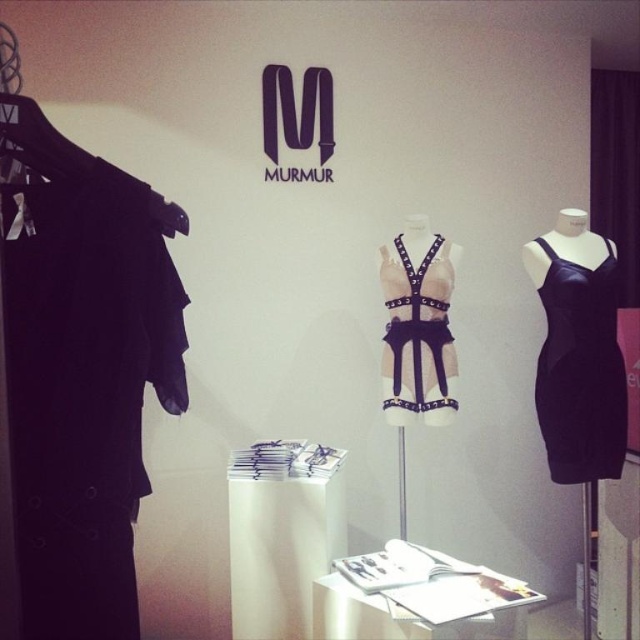
Question: Which of the following is the closest to the observer?

Choices:
 (A) satin black dress at right
 (B) leather harness at center

Answer: (A)

Question: Considering the relative positions of satin black dress at right and leather harness at center in the image provided, where is satin black dress at right located with respect to leather harness at center?

Choices:
 (A) above
 (B) below

Answer: (B)

Question: Is satin black dress at right to the left of leather harness at center from the viewer's perspective?

Choices:
 (A) yes
 (B) no

Answer: (B)

Question: Is satin black dress at right closer to the viewer compared to leather harness at center?

Choices:
 (A) yes
 (B) no

Answer: (A)

Question: Which object appears farthest from the camera in this image?

Choices:
 (A) satin black dress at right
 (B) leather harness at center

Answer: (B)